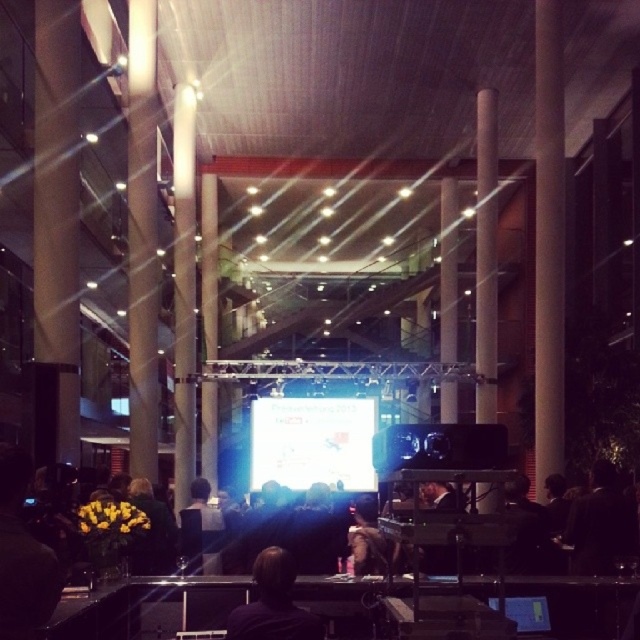
Question: Considering the relative positions of white glossy projection screen at center and dark hair at left in the image provided, where is white glossy projection screen at center located with respect to dark hair at left?

Choices:
 (A) right
 (B) left

Answer: (A)

Question: Which point appears closest to the camera in this image?

Choices:
 (A) (268, 573)
 (B) (300, 444)
 (C) (209, 532)

Answer: (A)

Question: Which of the following is the farthest from the observer?

Choices:
 (A) dark hair at lower right
 (B) white glossy projection screen at center
 (C) dark hair at left
 (D) dark hair at center

Answer: (B)

Question: Which point appears farthest from the camera in this image?

Choices:
 (A) (317, 474)
 (B) (10, 612)

Answer: (A)

Question: Can you confirm if dark hair at left is thinner than dark hair at center?

Choices:
 (A) no
 (B) yes

Answer: (B)

Question: Is white glossy projection screen at center thinner than dark brown hair at center?

Choices:
 (A) yes
 (B) no

Answer: (B)